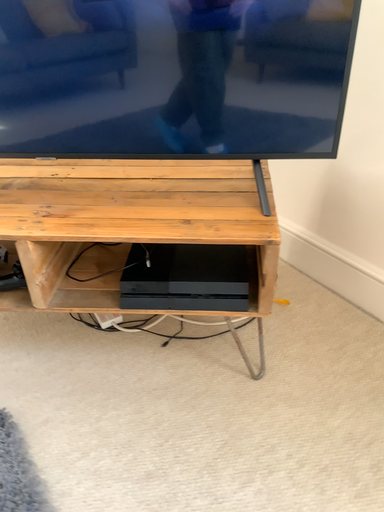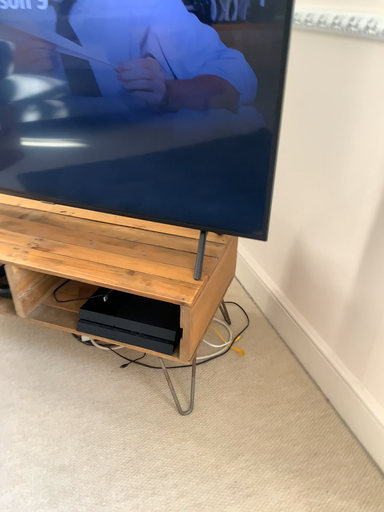
Question: Which way did the camera rotate in the video?

Choices:
 (A) rotated left
 (B) rotated right

Answer: (A)